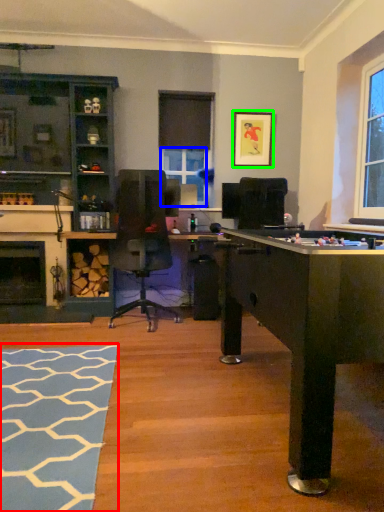
Question: Which object is positioned closest to flat (highlighted by a red box)? Select from window screen (highlighted by a blue box) and picture frame (highlighted by a green box).

Choices:
 (A) window screen
 (B) picture frame

Answer: (A)